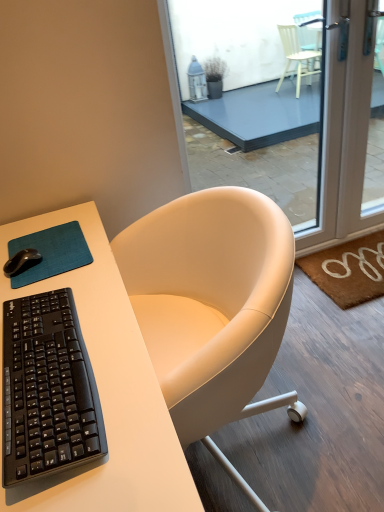
The height and width of the screenshot is (512, 384). In order to click on free location above teal fabric mousepad at lower left (from a real-world perspective) in this screenshot , I will do `click(46, 253)`.